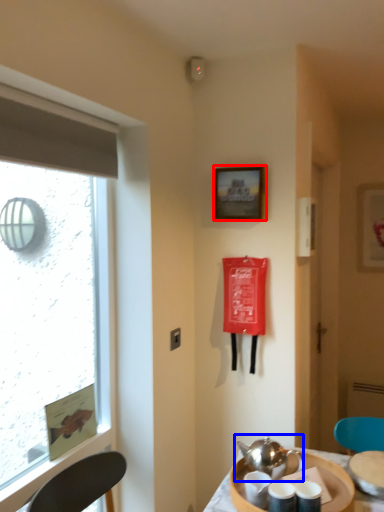
Question: Which of the following is the farthest to the observer, picture frame (highlighted by a red box) or tea set (highlighted by a blue box)?

Choices:
 (A) picture frame
 (B) tea set

Answer: (A)